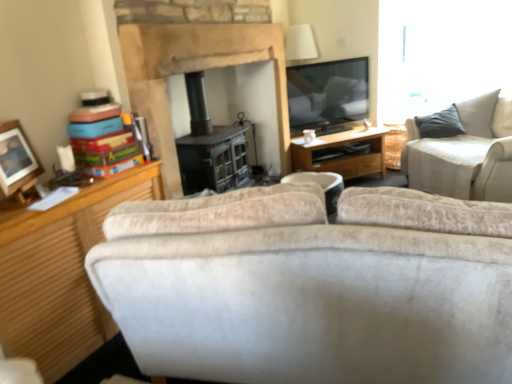
Locate an element on the screen. The image size is (512, 384). white fabric trash bin/can at center is located at coordinates (321, 185).

This screenshot has height=384, width=512. Find the location of `stone fireplace at center`. stone fireplace at center is located at coordinates (194, 71).

Describe the element at coordinates (194, 71) in the screenshot. I see `stone fireplace at center` at that location.

At what (x,y) coordinates should I click in order to perform the action: click on white ceramic coffee cup at center. Please return your answer as a coordinate pair (x, y). Looking at the image, I should click on (309, 135).

Identify the location of white fabric trash bin/can at center. (321, 185).

Is beige fabric couch at upper right facing towards wooden photo frame at left?

Yes, beige fabric couch at upper right is oriented towards wooden photo frame at left.

Between beige fabric couch at upper right and wooden photo frame at left, which one has less height?

Standing shorter between the two is wooden photo frame at left.

Considering the relative sizes of beige fabric couch at upper right and wooden photo frame at left in the image provided, is beige fabric couch at upper right thinner than wooden photo frame at left?

Incorrect, the width of beige fabric couch at upper right is not less than that of wooden photo frame at left.

Considering the positions of point (493, 194) and point (2, 172), is point (493, 194) closer or farther from the camera than point (2, 172)?

Point (493, 194) is positioned farther from the camera compared to point (2, 172).

Do you think wooden photo frame at left is within beige fabric couch at upper right, or outside of it?

wooden photo frame at left cannot be found inside beige fabric couch at upper right.

Between wooden photo frame at left and beige fabric couch at upper right, which one is positioned in front?

wooden photo frame at left is in front.

I want to click on picture frame on the left of beige fabric couch at upper right, so click(17, 160).

Does wooden photo frame at left have a lesser height compared to beige fabric couch at upper right?

Yes.

Looking at this image, which point is more forward, (29, 145) or (325, 142)?

Positioned in front is point (29, 145).

Considering the sizes of objects wooden photo frame at left and wooden desk at center in the image provided, who is thinner, wooden photo frame at left or wooden desk at center?

wooden photo frame at left is thinner.

Are wooden photo frame at left and wooden desk at center far apart?

Absolutely, wooden photo frame at left is distant from wooden desk at center.

Consider the image. Is wooden desk at center located within wooden photo frame at left?

Definitely not — wooden desk at center is not inside wooden photo frame at left.

Is beige fabric couch at upper right turned away from wooden desk at center?

No, beige fabric couch at upper right is not facing the opposite direction of wooden desk at center.

In the scene shown: From a real-world perspective, is beige fabric couch at upper right under wooden desk at center?

No, from a real-world perspective, beige fabric couch at upper right is not below wooden desk at center.

Does beige fabric couch at upper right have a larger size compared to wooden desk at center?

Yes, beige fabric couch at upper right is bigger than wooden desk at center.

Considering their positions, is beige fabric couch at upper right located in front of or behind wooden desk at center?

Clearly, beige fabric couch at upper right is in front of wooden desk at center.

Which is closer, [338,189] or [302,165]?

Positioned in front is point [338,189].

Looking at this image, considering the sizes of objects white fabric trash bin/can at center and wooden desk at center in the image provided, who is smaller, white fabric trash bin/can at center or wooden desk at center?

With smaller size is white fabric trash bin/can at center.

From the image's perspective, which one is positioned lower, white fabric trash bin/can at center or wooden desk at center?

white fabric trash bin/can at center is shown below in the image.

Does white fabric trash bin/can at center appear on the right side of wooden desk at center?

Incorrect, white fabric trash bin/can at center is not on the right side of wooden desk at center.

Between beige fabric couch at upper right and white ceramic coffee cup at center, which one is positioned behind?

white ceramic coffee cup at center is more distant.

Between beige fabric couch at upper right and white ceramic coffee cup at center, which one appears on the right side from the viewer's perspective?

From the viewer's perspective, beige fabric couch at upper right appears more on the right side.

Could you tell me if beige fabric couch at upper right is turned towards white ceramic coffee cup at center?

Yes, beige fabric couch at upper right faces towards white ceramic coffee cup at center.

From a real-world perspective, is stone fireplace at center beneath beige fabric couch at upper right?

No, from a real-world perspective, stone fireplace at center is not under beige fabric couch at upper right.

Are stone fireplace at center and beige fabric couch at upper right beside each other?

They are not placed beside each other.

The width and height of the screenshot is (512, 384). What are the coordinates of `studio couch on the right of stone fireplace at center` in the screenshot? It's located at (465, 154).

Is stone fireplace at center facing away from beige fabric couch at upper right?

No, stone fireplace at center is not facing away from beige fabric couch at upper right.

The width and height of the screenshot is (512, 384). What are the coordinates of `picture frame located above the beige fabric couch at upper right (from a real-world perspective)` in the screenshot? It's located at (17, 160).

Where is `studio couch beneath the wooden photo frame at left (from a real-world perspective)`? studio couch beneath the wooden photo frame at left (from a real-world perspective) is located at coordinates (465, 154).

From the image, which object appears to be nearer to wooden desk at center, beige fabric couch at upper right or wooden photo frame at left?

beige fabric couch at upper right is closer to wooden desk at center.

From the image, which object appears to be farther from white fabric trash bin/can at center, beige fabric couch at upper right or wooden desk at center?

Based on the image, beige fabric couch at upper right appears to be further to white fabric trash bin/can at center.

When comparing their distances from wooden desk at center, does white ceramic coffee cup at center or wooden photo frame at left seem closer?

white ceramic coffee cup at center is positioned closer to the anchor wooden desk at center.

Based on their spatial positions, is white ceramic coffee cup at center or white fabric trash bin/can at center closer to wooden desk at center?

white ceramic coffee cup at center lies closer to wooden desk at center than the other object.

From the image, which object appears to be nearer to stone fireplace at center, wooden desk at center or beige fabric couch at upper right?

Based on the image, wooden desk at center appears to be nearer to stone fireplace at center.

Which object lies further to the anchor point white ceramic coffee cup at center, stone fireplace at center or beige fabric couch at upper right?

beige fabric couch at upper right is further to white ceramic coffee cup at center.

Which object lies further to the anchor point stone fireplace at center, beige fabric couch at upper right or white fabric trash bin/can at center?

Among the two, beige fabric couch at upper right is located further to stone fireplace at center.

When comparing their distances from wooden photo frame at left, does white fabric trash bin/can at center or white ceramic coffee cup at center seem further?

Based on the image, white ceramic coffee cup at center appears to be further to wooden photo frame at left.

I want to click on coffee cup between wooden photo frame at left and beige fabric couch at upper right, so click(309, 135).

Find the location of a particular element. This screenshot has height=384, width=512. desk between wooden photo frame at left and beige fabric couch at upper right is located at coordinates (344, 155).

This screenshot has height=384, width=512. In order to click on trash bin/can between stone fireplace at center and beige fabric couch at upper right in the horizontal direction in this screenshot , I will do `click(321, 185)`.

Identify the location of desk between wooden photo frame at left and white ceramic coffee cup at center along the z-axis. (344, 155).